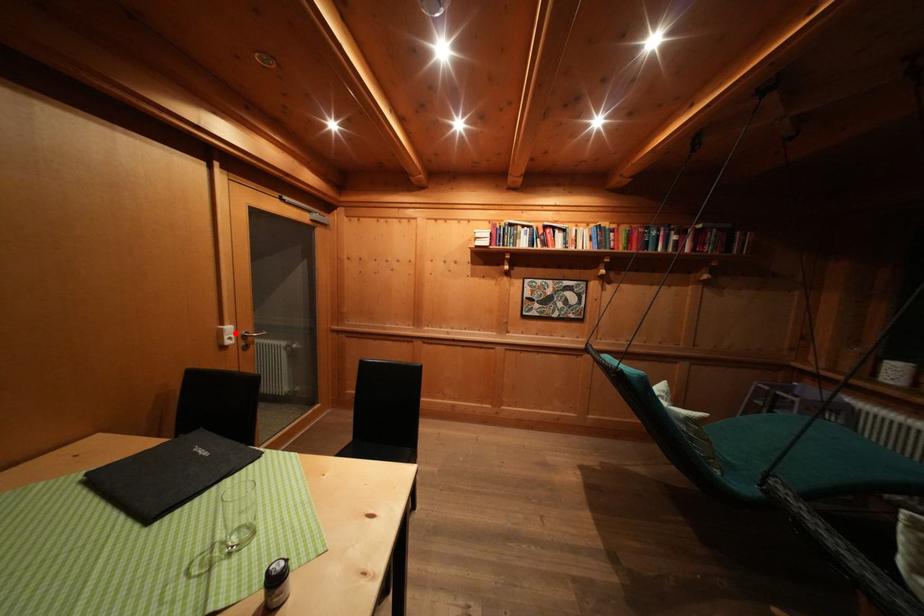
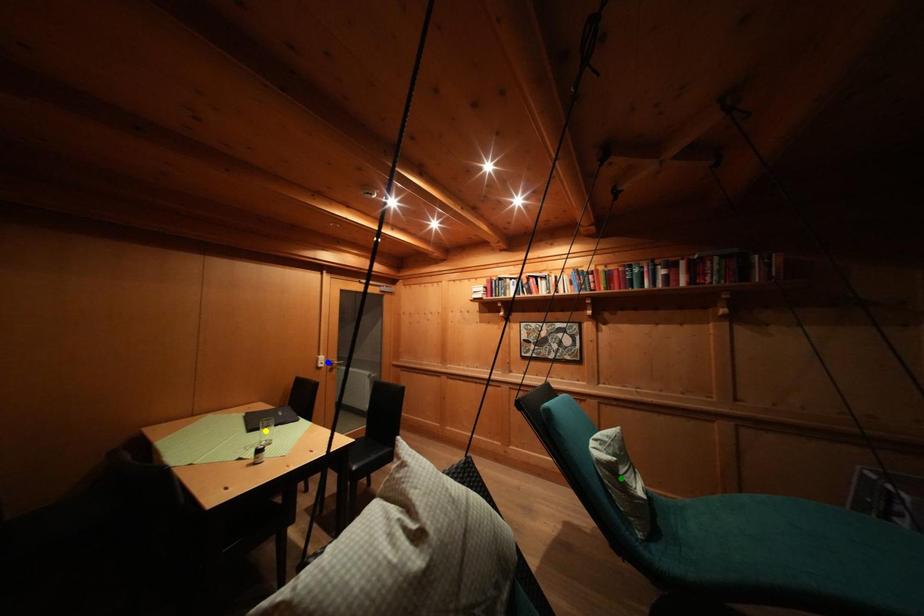
Question: I am providing you with two images of the same scene from different viewpoints. A red point is marked on the first image. You are given multiple points on the second image. In image 2, which mark is for the same physical point as the one in image 1?

Choices:
 (A) blue point
 (B) green point
 (C) yellow point

Answer: (A)